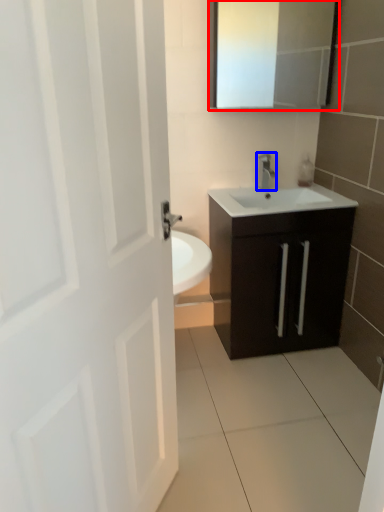
Question: Among these objects, which one is farthest to the camera, medicine cabinet (highlighted by a red box) or tap (highlighted by a blue box)?

Choices:
 (A) medicine cabinet
 (B) tap

Answer: (B)